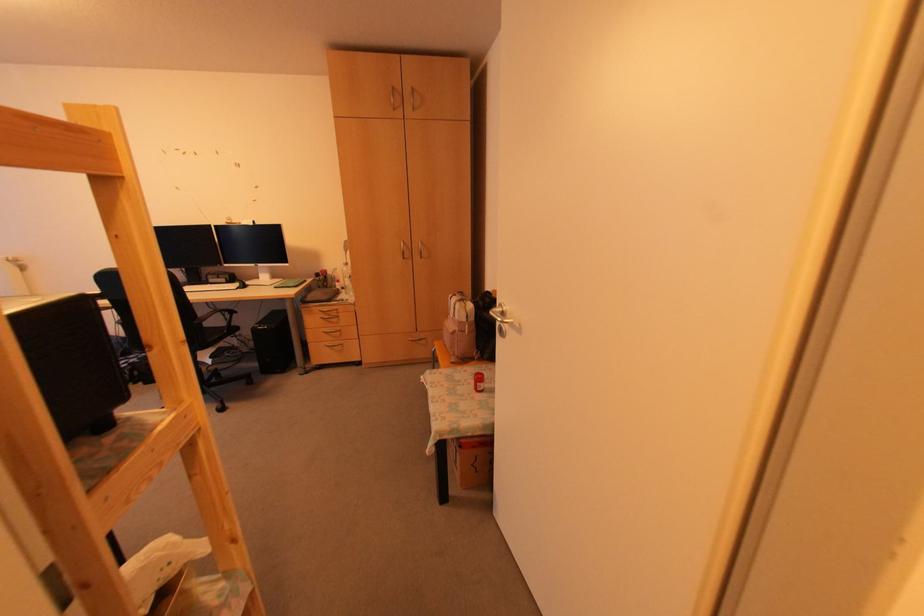
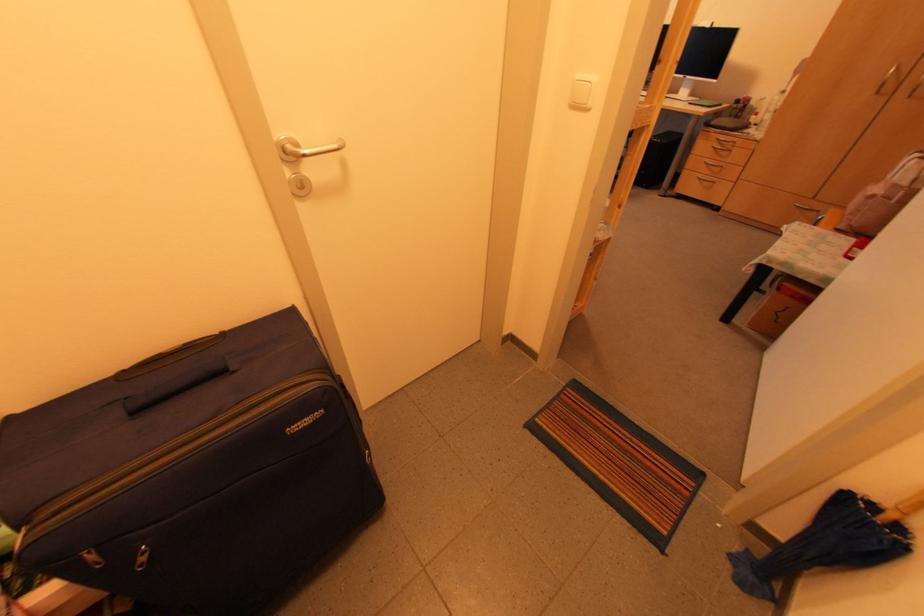
Where in the second image is the point corresponding to the point at 419,257 from the first image?

(907, 97)